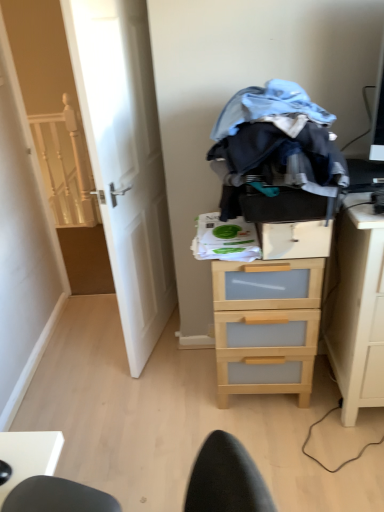
Question: Is light wood/transparent drawer at center far from light wood/transparent drawer at right?

Choices:
 (A) yes
 (B) no

Answer: (B)

Question: Does light wood/transparent drawer at center have a lesser height compared to light wood/transparent drawer at right?

Choices:
 (A) no
 (B) yes

Answer: (B)

Question: Is light wood/transparent drawer at center positioned before light wood/transparent drawer at right?

Choices:
 (A) yes
 (B) no

Answer: (B)

Question: Does light wood/transparent drawer at center touch light wood/transparent drawer at right?

Choices:
 (A) no
 (B) yes

Answer: (A)

Question: Is light wood/transparent drawer at center to the right of light wood/transparent drawer at right from the viewer's perspective?

Choices:
 (A) yes
 (B) no

Answer: (B)

Question: From the image's perspective, is light wood/transparent drawer at center located above light wood/transparent drawer at right?

Choices:
 (A) yes
 (B) no

Answer: (B)

Question: From the image's perspective, is white wooden stairwell at left below denim fabric clothes at center?

Choices:
 (A) no
 (B) yes

Answer: (A)

Question: Does white wooden stairwell at left appear on the left side of denim fabric clothes at center?

Choices:
 (A) no
 (B) yes

Answer: (B)

Question: Is white wooden stairwell at left positioned far away from denim fabric clothes at center?

Choices:
 (A) no
 (B) yes

Answer: (B)

Question: Does white wooden stairwell at left have a larger size compared to denim fabric clothes at center?

Choices:
 (A) yes
 (B) no

Answer: (B)

Question: Is white wooden stairwell at left further to camera compared to denim fabric clothes at center?

Choices:
 (A) yes
 (B) no

Answer: (A)

Question: Can you confirm if white wooden stairwell at left is taller than denim fabric clothes at center?

Choices:
 (A) yes
 (B) no

Answer: (A)

Question: Could you tell me if wooden drawer at center is facing light wood/transparent drawer at center?

Choices:
 (A) yes
 (B) no

Answer: (B)